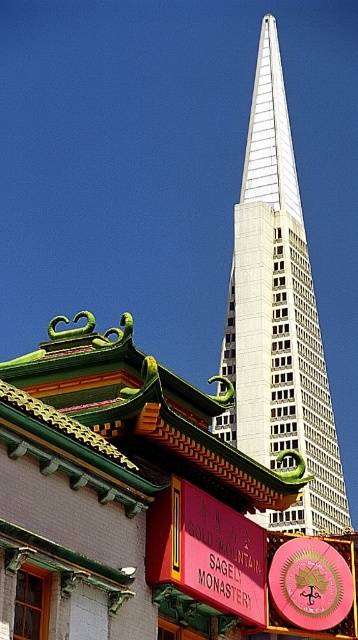
Is white glass skyscraper at center to the right of pink glossy clock at center from the viewer's perspective?

Correct, you'll find white glass skyscraper at center to the right of pink glossy clock at center.

Which of these two, white glass skyscraper at center or pink glossy clock at center, stands taller?

Standing taller between the two is white glass skyscraper at center.

Which is in front, point (262, 342) or point (271, 561)?

Point (271, 561)

The width and height of the screenshot is (358, 640). I want to click on white glass skyscraper at center, so click(x=278, y=317).

Can you confirm if red matte sign at center is shorter than pink glossy clock at center?

Correct, red matte sign at center is not as tall as pink glossy clock at center.

Is red matte sign at center thinner than pink glossy clock at center?

Yes, red matte sign at center is thinner than pink glossy clock at center.

Between point (242, 586) and point (311, 593), which one is positioned in front?

Point (242, 586) is more forward.

This screenshot has height=640, width=358. I want to click on red matte sign at center, so click(x=220, y=556).

Which is more to the right, white glass skyscraper at center or red matte sign at center?

white glass skyscraper at center

Is point (326, 394) behind point (197, 499)?

Yes, it is.

Find the location of a particular element. The image size is (358, 640). white glass skyscraper at center is located at coordinates (278, 317).